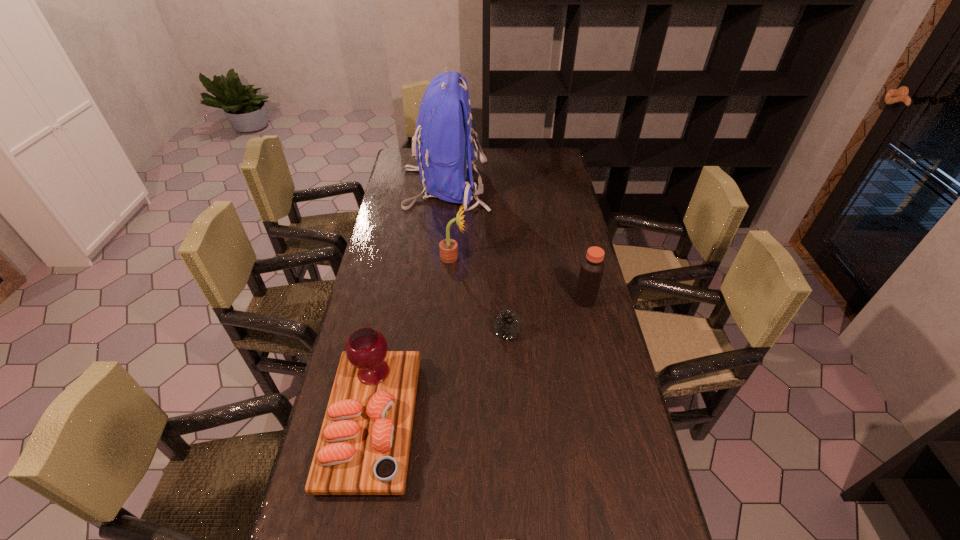
At what (x,y) coordinates should I click in order to perform the action: click on backpack. Please return your answer as a coordinate pair (x, y). Looking at the image, I should click on (443, 139).

The width and height of the screenshot is (960, 540). Find the location of `the tallest object`. the tallest object is located at coordinates (x=443, y=139).

Where is `sunflower`? sunflower is located at coordinates (448, 247).

Find the location of `the third nearest object`. the third nearest object is located at coordinates (592, 267).

You are a GUI agent. You are given a task and a screenshot of the screen. Output one action in this format:
    pyautogui.click(x=<x>, y=<y>)
    Task: Click on the vinegar
    The height and width of the screenshot is (540, 960).
    Given the screenshot: What is the action you would take?
    pyautogui.click(x=592, y=267)

At what (x,y) coordinates should I click in order to perform the action: click on the nearest object. Please return your answer as a coordinate pair (x, y). This screenshot has width=960, height=540. Looking at the image, I should click on (363, 448).

The image size is (960, 540). In order to click on pinecone in this screenshot , I will do `click(507, 323)`.

The image size is (960, 540). Find the location of `the shortest object`. the shortest object is located at coordinates (507, 323).

The width and height of the screenshot is (960, 540). Identify the location of free space located 0.320m on the back of the backpack. (564, 187).

Find the location of a particular element. free space located 0.070m on the face of the fourth nearest object is located at coordinates (486, 257).